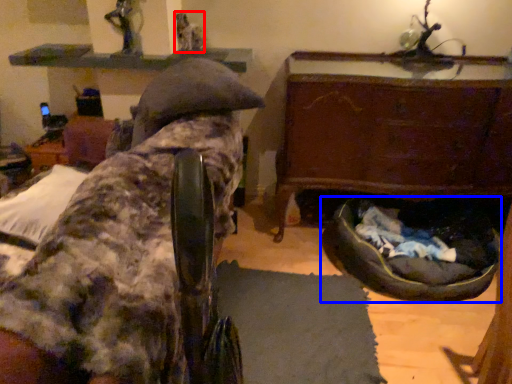
Question: Which point is closer to the camera, person (highlighted by a red box) or dog bed (highlighted by a blue box)?

Choices:
 (A) person
 (B) dog bed

Answer: (B)